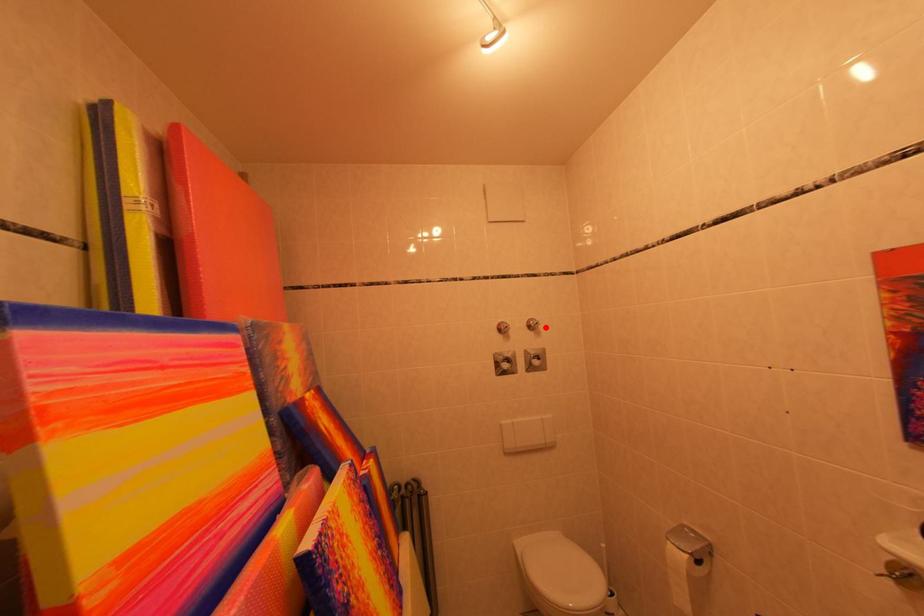
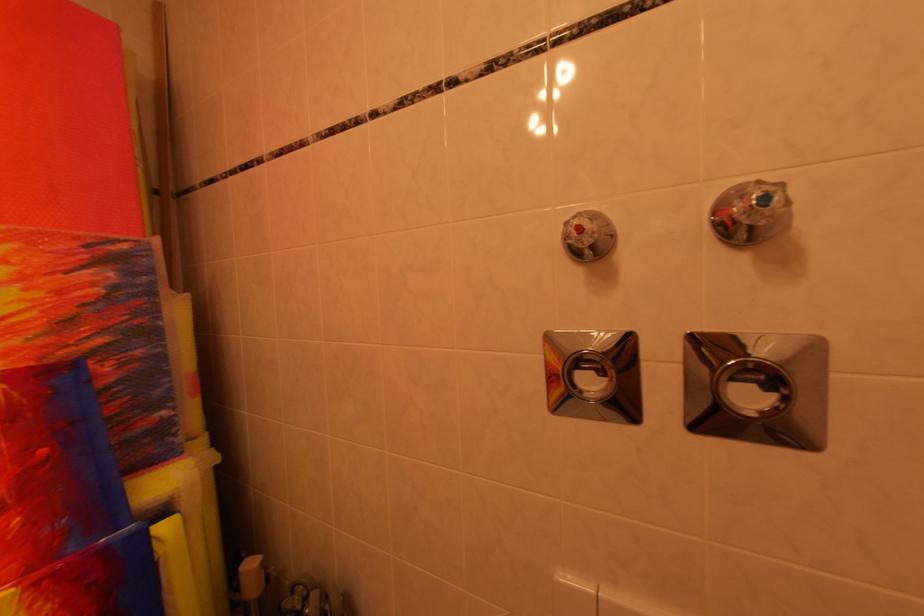
Question: I am providing you with two images of the same scene from different viewpoints. A red point is marked on the first image. Can you still see the location of the red point in image 2?

Choices:
 (A) Yes
 (B) No

Answer: (A)